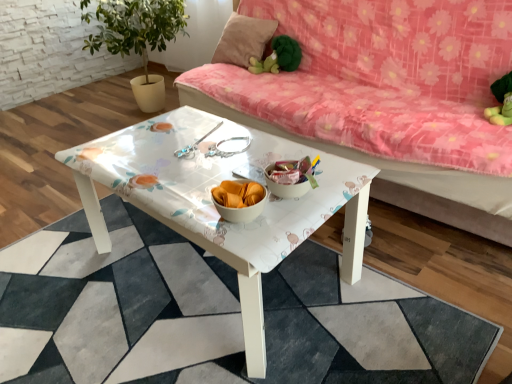
Locate an element on the screen. blank space situated above white glossy coffee table at center (from a real-world perspective) is located at coordinates (195, 155).